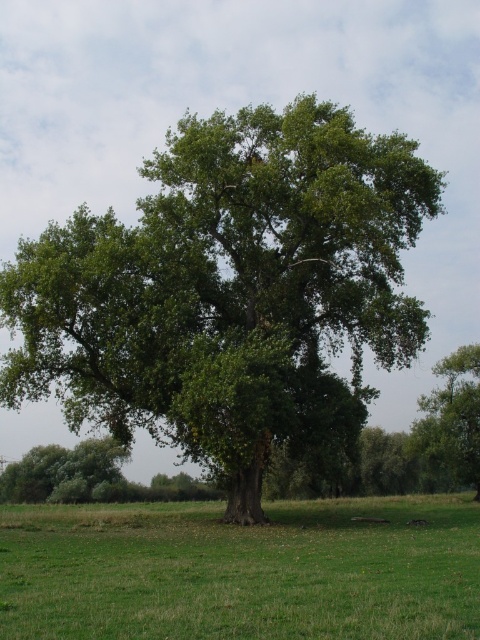
Who is positioned more to the right, green leafy oak tree at center or green grass at center?

Positioned to the right is green leafy oak tree at center.

Is point (252, 266) farther from camera compared to point (108, 516)?

No, it is in front of (108, 516).

The width and height of the screenshot is (480, 640). What do you see at coordinates (228, 291) in the screenshot? I see `green leafy oak tree at center` at bounding box center [228, 291].

The width and height of the screenshot is (480, 640). Find the location of `green leafy oak tree at center`. green leafy oak tree at center is located at coordinates 228,291.

Does green leafy oak tree at center appear under green leafy tree at center?

Incorrect, green leafy oak tree at center is not positioned below green leafy tree at center.

Who is more forward, (243, 356) or (446, 472)?

Point (243, 356) is in front.

At what (x,y) coordinates should I click in order to perform the action: click on green leafy oak tree at center. Please return your answer as a coordinate pair (x, y). The image size is (480, 640). Looking at the image, I should click on (228, 291).

Can you confirm if green grass at center is positioned below green leafy tree at center?

Incorrect, green grass at center is not positioned below green leafy tree at center.

Locate an element on the screen. The image size is (480, 640). green grass at center is located at coordinates (241, 572).

Who is more forward, (423, 515) or (451, 368)?

Point (423, 515) is more forward.

Locate an element on the screen. This screenshot has width=480, height=640. green grass at center is located at coordinates (241, 572).